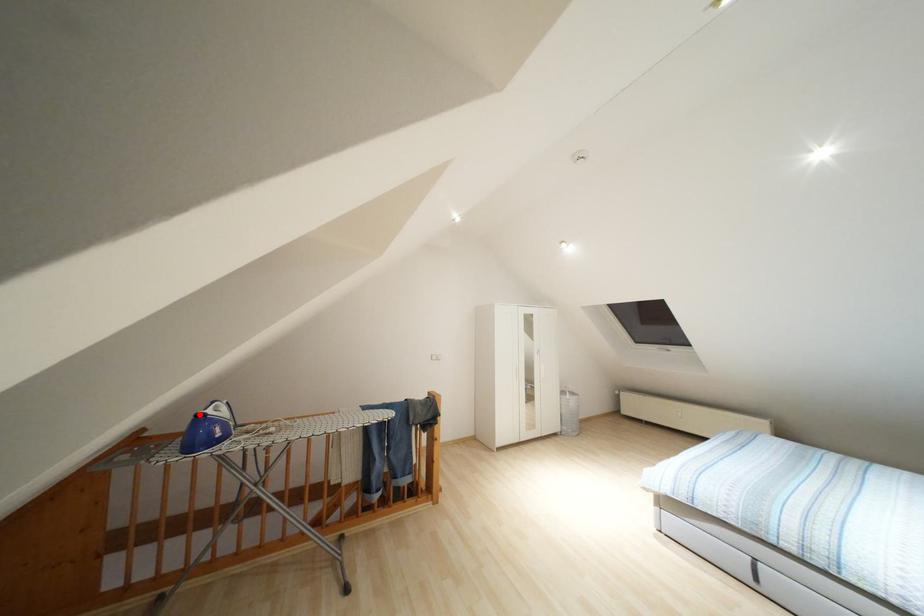
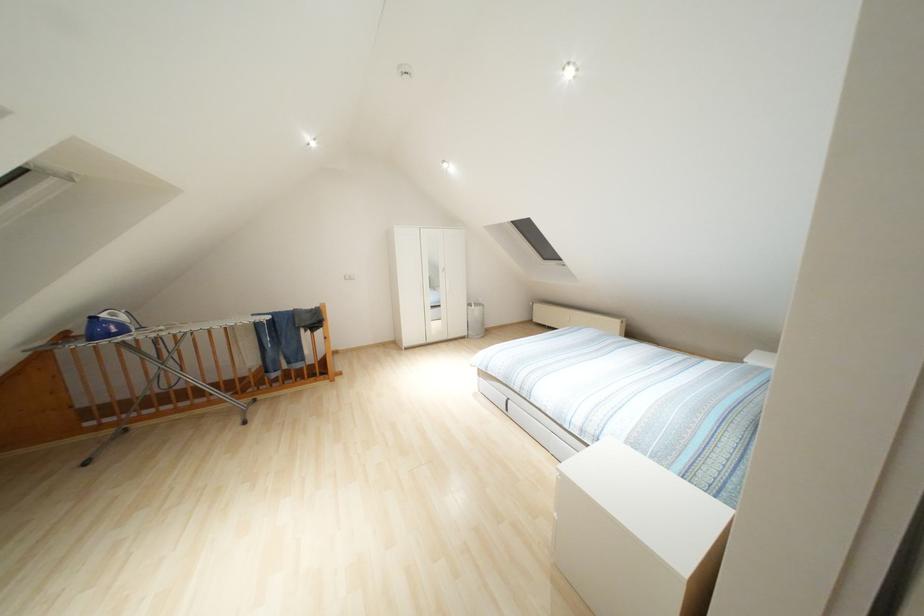
Question: I am providing you with two images of the same scene from different viewpoints. Given a red point in image1, look at the same physical point in image2. Is it:

Choices:
 (A) Closer to the viewpoint
 (B) Farther from the viewpoint

Answer: (A)